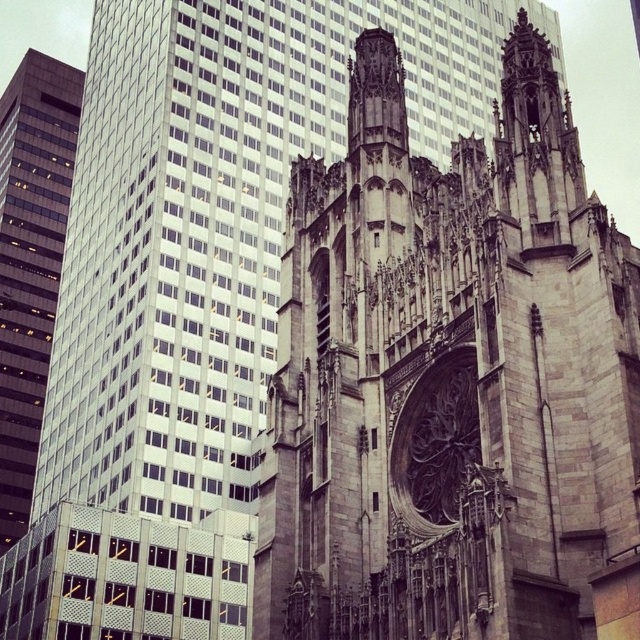
Is gray stone cathedral at center above matte glass skyscraper at left?

Incorrect, gray stone cathedral at center is not positioned above matte glass skyscraper at left.

Which of these two, gray stone cathedral at center or matte glass skyscraper at left, stands taller?

Standing taller between the two is matte glass skyscraper at left.

This screenshot has height=640, width=640. I want to click on gray stone cathedral at center, so click(x=452, y=381).

Identify the location of gray stone cathedral at center. (452, 381).